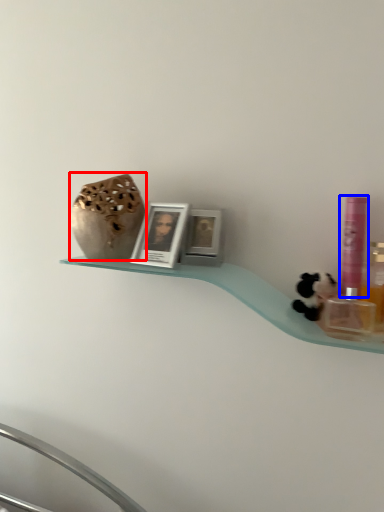
Question: Which point is closer to the camera, vase (highlighted by a red box) or mouthwash (highlighted by a blue box)?

Choices:
 (A) vase
 (B) mouthwash

Answer: (B)